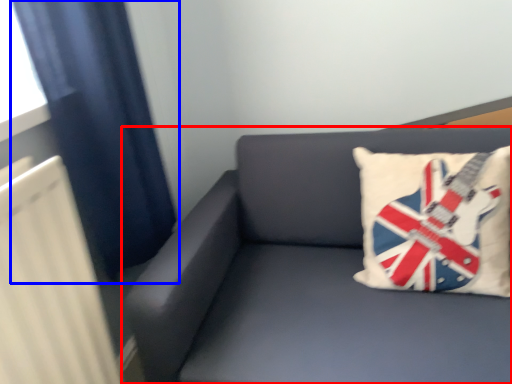
Question: Which object is further to the camera taking this photo, studio couch (highlighted by a red box) or curtain (highlighted by a blue box)?

Choices:
 (A) studio couch
 (B) curtain

Answer: (B)